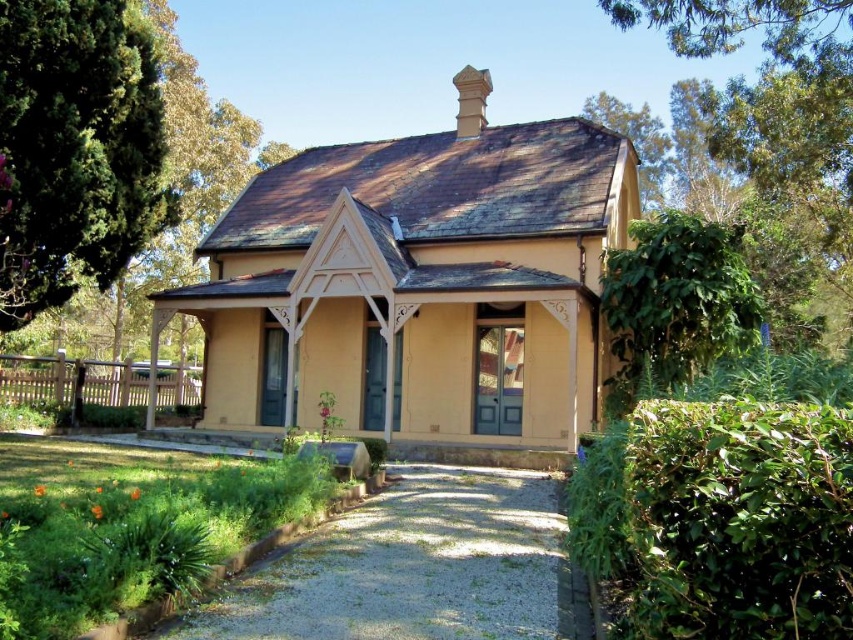
What do you see at coordinates (415, 570) in the screenshot? Image resolution: width=853 pixels, height=640 pixels. I see `gray gravel driveway at center` at bounding box center [415, 570].

Does point (421, 589) come in front of point (137, 96)?

Yes, point (421, 589) is closer to viewer.

Where is `gray gravel driveway at center`? Image resolution: width=853 pixels, height=640 pixels. gray gravel driveway at center is located at coordinates click(415, 570).

Can you confirm if matte yellow house at center is positioned to the right of gray gravel driveway at center?

In fact, matte yellow house at center is to the left of gray gravel driveway at center.

What do you see at coordinates (418, 285) in the screenshot?
I see `matte yellow house at center` at bounding box center [418, 285].

Locate an element on the screen. matte yellow house at center is located at coordinates (418, 285).

The width and height of the screenshot is (853, 640). Describe the element at coordinates (418, 285) in the screenshot. I see `matte yellow house at center` at that location.

Can you confirm if matte yellow house at center is positioned to the right of white wooden porch at lower left?

Indeed, matte yellow house at center is positioned on the right side of white wooden porch at lower left.

Is point (579, 260) closer to camera compared to point (21, 384)?

Yes.

Image resolution: width=853 pixels, height=640 pixels. Identify the location of matte yellow house at center. (418, 285).